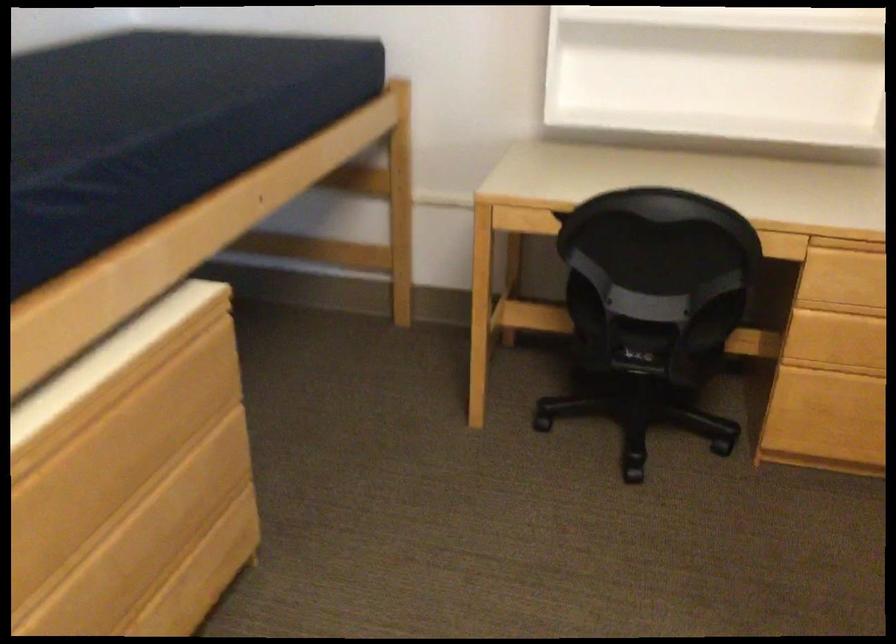
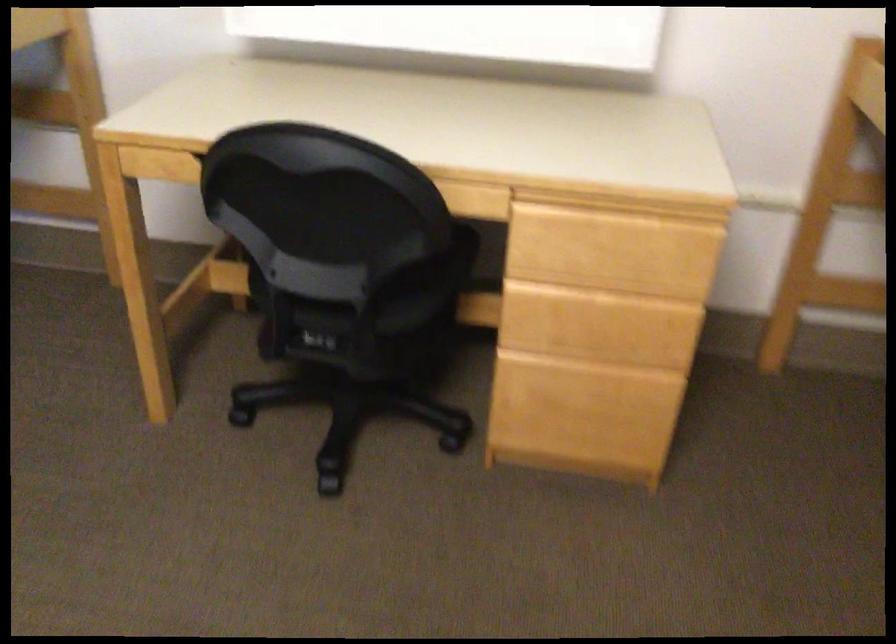
The point at (x=650, y=307) is marked in the first image. Where is the corresponding point in the second image?

(322, 279)